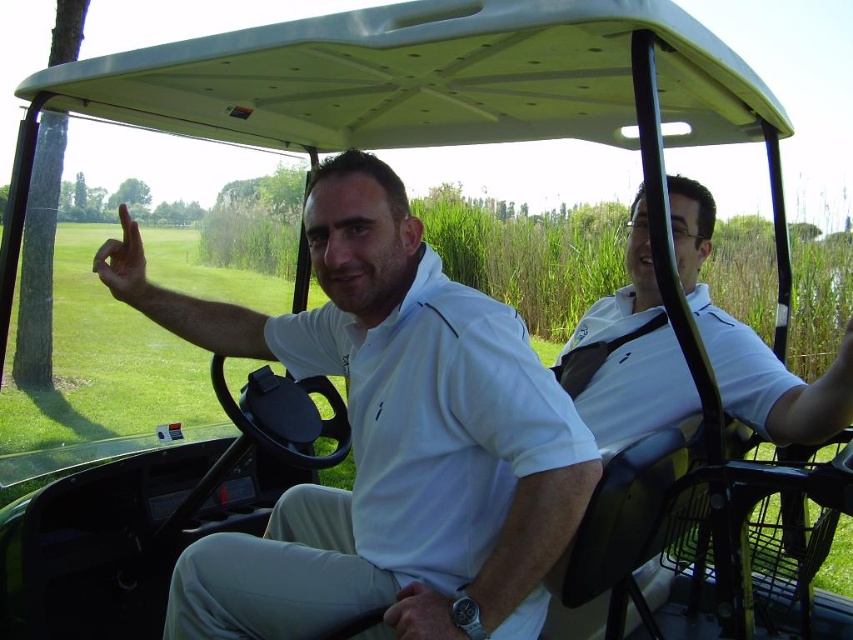
You are a tailor measuring shirts for a customer. You have two shirts in the image, a white smooth shirt at center and a white matte shirt at center. The customer wants to know if they can fit both shirts side by side on a 1.5 meter wide shelf. Can they?

The white smooth shirt at center is 75.01 centimeters from white matte shirt at center. Adding both shirts together would total 150.02 centimeters, which exceeds the 150 centimeter width of the shelf. Therefore, the shirts cannot fit side by side on the shelf.

You are a photographer standing to the side of the golf cart. You notice two people wearing shirts at the center. Which shirt, the white smooth shirt at center or the white matte shirt at center, might require more space in the frame to capture fully?

The white smooth shirt at center might be wider than the white matte shirt at center, so the white smooth shirt at center would require more space in the frame to capture fully.

You are a photographer standing behind the golf cart and want to take a photo of both individuals wearing their shirts. Which shirt, the white smooth shirt at center or the white matte shirt at center, is positioned lower on the person?

The white smooth shirt at center is located below the white matte shirt at center, so the white smooth shirt at center is positioned lower on the person.